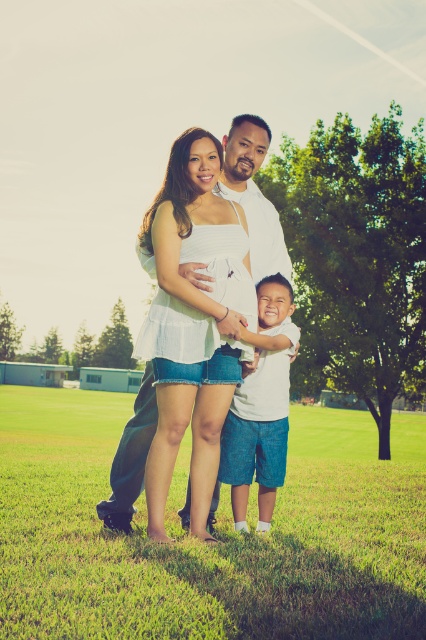
Question: Which object is positioned farthest from the white cotton shirt at center?

Choices:
 (A) green grass at lower center
 (B) white matte dress at center

Answer: (A)

Question: Estimate the real-world distances between objects in this image. Which object is closer to the white cotton shirt at center?

Choices:
 (A) white matte dress at center
 (B) green grass at lower center

Answer: (A)

Question: Does green grass at lower center have a smaller size compared to white cotton shirt at center?

Choices:
 (A) yes
 (B) no

Answer: (B)

Question: Which of these objects is positioned closest to the white matte dress at center?

Choices:
 (A) green grass at lower center
 (B) white cotton shirt at center

Answer: (B)

Question: Can you confirm if white matte dress at center is positioned above white cotton shirt at center?

Choices:
 (A) yes
 (B) no

Answer: (A)

Question: Is green grass at lower center wider than white cotton shirt at center?

Choices:
 (A) yes
 (B) no

Answer: (A)